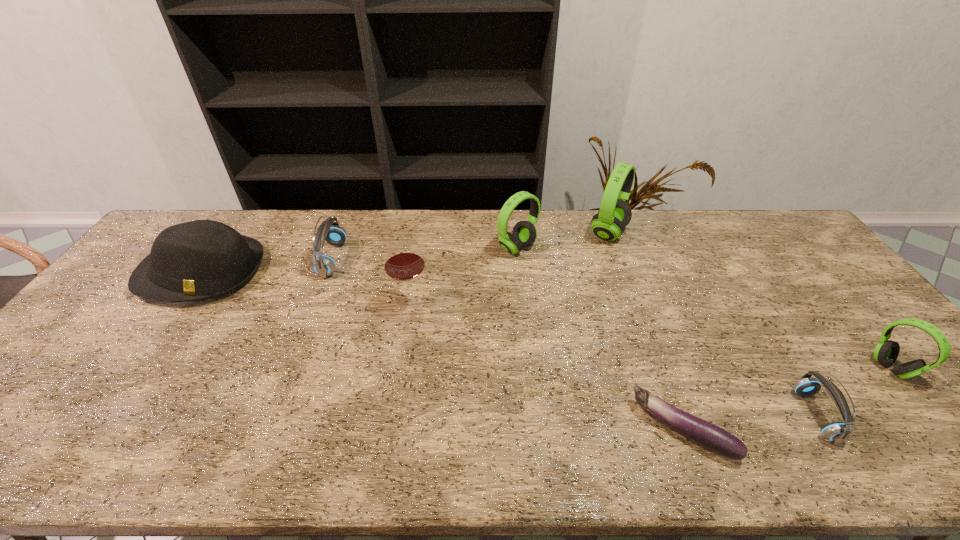
Locate an element on the screen. The height and width of the screenshot is (540, 960). the bigger blue headset is located at coordinates (324, 265).

In order to click on the second object from left to right in this screenshot , I will do `click(324, 265)`.

Image resolution: width=960 pixels, height=540 pixels. Find the location of `the shortest headset`. the shortest headset is located at coordinates (837, 432).

In order to click on the smaller blue headset in this screenshot , I will do `click(837, 432)`.

Find the location of `the shortest object`. the shortest object is located at coordinates (710, 436).

You are a GUI agent. You are given a task and a screenshot of the screen. Output one action in this format:
    pyautogui.click(x=<x>, y=<y>)
    Task: Click on the purple eggplant
    This screenshot has width=960, height=540.
    Given the screenshot: What is the action you would take?
    pyautogui.click(x=710, y=436)

Image resolution: width=960 pixels, height=540 pixels. I want to click on vacant space positioned 0.200m on the right of the second green headset from left to right, so click(687, 233).

Image resolution: width=960 pixels, height=540 pixels. In order to click on vacant area situated 0.130m on the left of the fifth object from right to left in this screenshot , I will do `click(456, 248)`.

Find the location of a particular element. The width and height of the screenshot is (960, 540). free space located 0.260m on the back of the wineglass is located at coordinates (421, 239).

At what (x,y) coordinates should I click in order to perform the action: click on blank area located 0.270m on the front-facing side of the fedora. Please return your answer as a coordinate pair (x, y). This screenshot has width=960, height=540. Looking at the image, I should click on [119, 391].